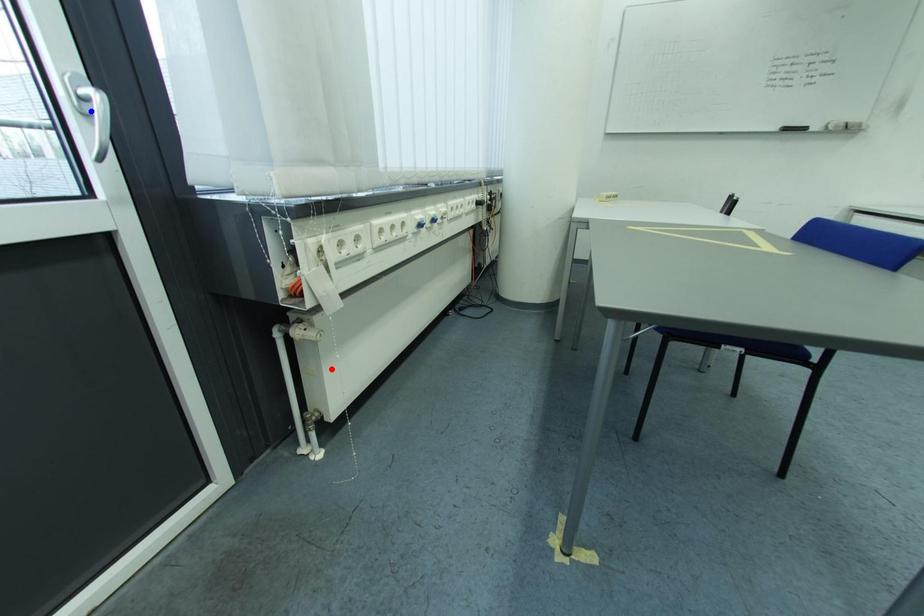
Question: Which of the two points in the image is closer to the camera?

Choices:
 (A) Blue point is closer.
 (B) Red point is closer.

Answer: (B)